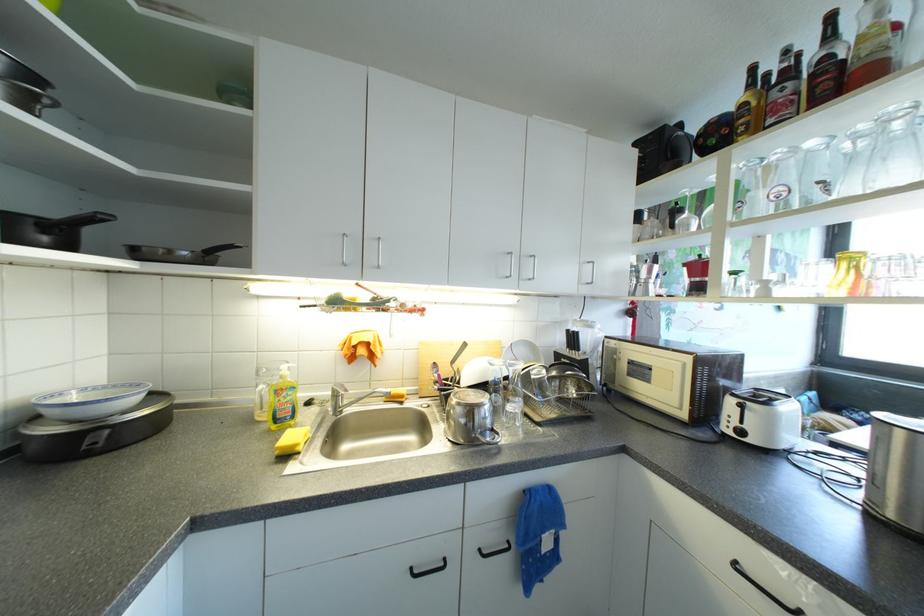
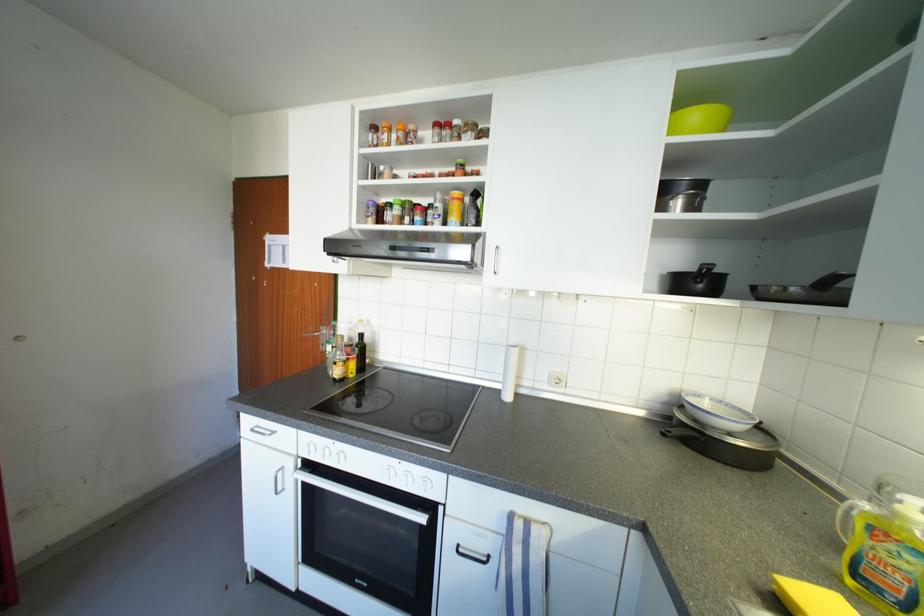
Where in the second image is the point corresponding to the point at 298,440 from the first image?

(824, 602)